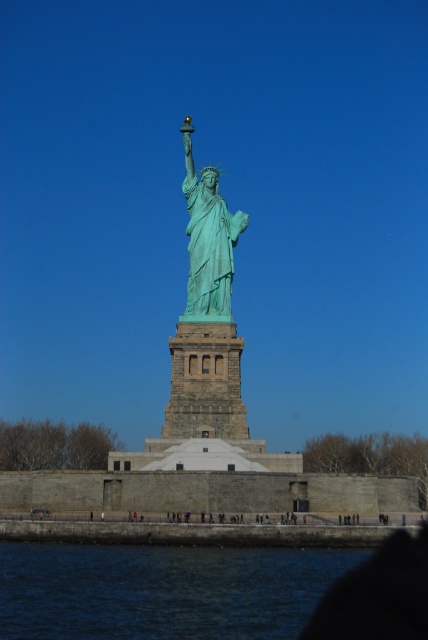
You are a tourist standing at the base of the Statue of Liberty. You notice two points marked on the statue. The first point is at coordinates point (166, 621) and the second is at point (201, 305). Which point is closer to you?

Point (166, 621) is closer to the viewer than point (201, 305).

You are a photographer planning to capture the Statue of Liberty from a boat. You want to ensure that both the blue liquid water at lower left and the green patina statue at center are visible in your shot. Given that your camera has a fixed focal length, which object should you position closer to the edge of the frame to include more of the other in the photo?

Since the blue liquid water at lower left is wider than the green patina statue at center, you should position the green patina statue at center closer to the edge of the frame to include more of the blue liquid water at lower left in the photo.